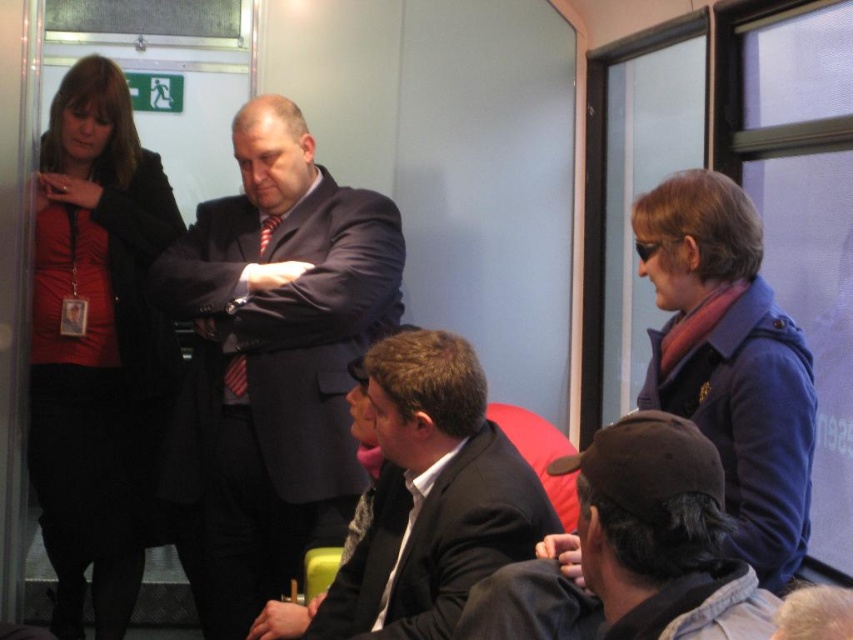
Based on the photo, does matte black suit at center have a greater height compared to dark brown leather cap at lower right?

Indeed, matte black suit at center has a greater height compared to dark brown leather cap at lower right.

Is point (422, 474) in front of point (688, 538)?

No.

At what (x,y) coordinates should I click in order to perform the action: click on matte black suit at center. Please return your answer as a coordinate pair (x, y). This screenshot has height=640, width=853. Looking at the image, I should click on (425, 499).

Which is more to the left, dark blue suit at center or dark brown leather cap at lower right?

Positioned to the left is dark blue suit at center.

What do you see at coordinates (270, 364) in the screenshot? The width and height of the screenshot is (853, 640). I see `dark blue suit at center` at bounding box center [270, 364].

Image resolution: width=853 pixels, height=640 pixels. Find the location of `dark blue suit at center`. dark blue suit at center is located at coordinates (270, 364).

Can you confirm if dark blue suit at center is smaller than matte black suit at center?

No, dark blue suit at center is not smaller than matte black suit at center.

Between point (282, 545) and point (450, 513), which one is positioned in front?

Point (450, 513) is more forward.

The width and height of the screenshot is (853, 640). In order to click on dark blue suit at center in this screenshot , I will do `click(270, 364)`.